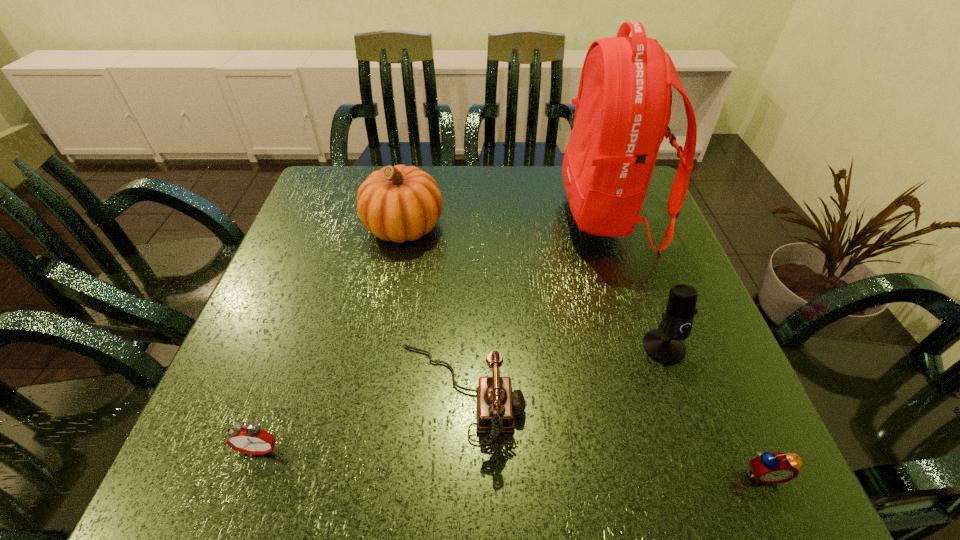
Locate an element on the screen. This screenshot has width=960, height=540. free spot between the farther alarm clock and the right alarm clock is located at coordinates (512, 461).

In order to click on free area in between the second tallest object and the telephone in this screenshot , I will do click(x=432, y=312).

The image size is (960, 540). I want to click on free space that is in between the telephone and the fourth shortest object, so click(562, 373).

Find the location of `empty space between the tallest object and the microphone`. empty space between the tallest object and the microphone is located at coordinates (636, 281).

Identify the location of free spot between the nearer alarm clock and the pumpkin. The width and height of the screenshot is (960, 540). (584, 350).

Find the location of a particular element. free spot between the tallest object and the microphone is located at coordinates (636, 281).

Locate an element on the screen. free space between the pumpkin and the telephone is located at coordinates (432, 312).

Where is `free space between the pumpkin and the backpack`? The image size is (960, 540). free space between the pumpkin and the backpack is located at coordinates (506, 221).

The image size is (960, 540). Find the location of `the fifth closest object to the right alarm clock`. the fifth closest object to the right alarm clock is located at coordinates (252, 440).

This screenshot has height=540, width=960. What are the coordinates of `object that is the closest to the second tallest object` in the screenshot? It's located at (496, 403).